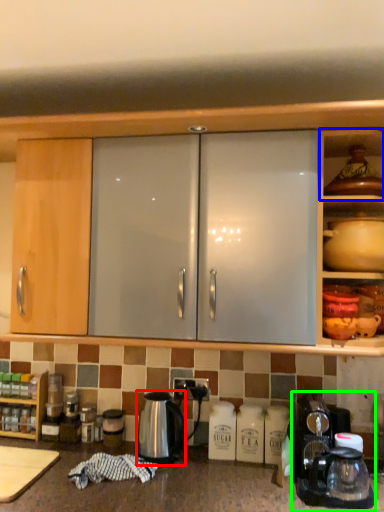
Question: Estimate the real-world distances between objects in this image. Which object is farther from kettle (highlighted by a red box), shelf (highlighted by a blue box) or coffee machine (highlighted by a green box)?

Choices:
 (A) shelf
 (B) coffee machine

Answer: (A)